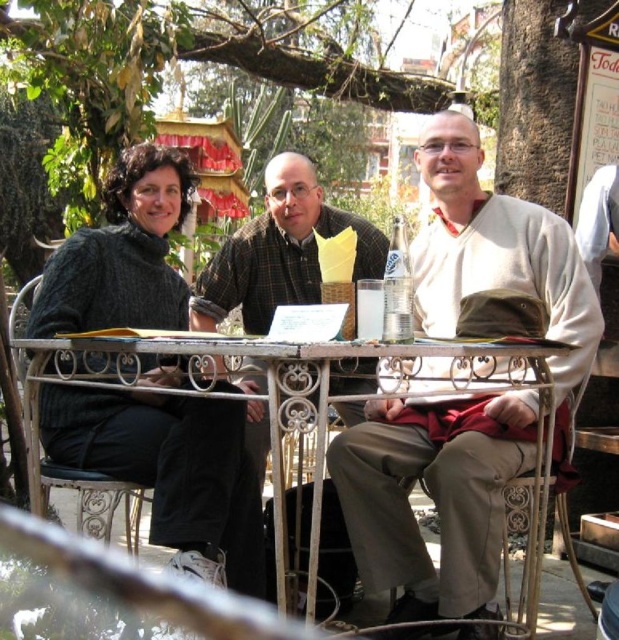
Does matte beige sweater at center have a lesser height compared to white wrought iron table at center?

Incorrect, matte beige sweater at center's height does not fall short of white wrought iron table at center's.

Who is taller, matte beige sweater at center or white wrought iron table at center?

matte beige sweater at center is taller.

This screenshot has height=640, width=619. In order to click on matte beige sweater at center in this screenshot , I will do `click(435, 484)`.

Who is taller, matte beige sweater at center or dark gray knitted sweater at left?

matte beige sweater at center is taller.

Does matte beige sweater at center have a larger size compared to dark gray knitted sweater at left?

Yes, matte beige sweater at center is bigger than dark gray knitted sweater at left.

Does point (517, 284) lie in front of point (171, 436)?

No, it is not.

Locate an element on the screen. The width and height of the screenshot is (619, 640). matte beige sweater at center is located at coordinates (435, 484).

Who is more forward, (67, 269) or (534, 445)?

Positioned in front is point (534, 445).

Is dark gray knitted sweater at left in front of white wrought iron table at center?

No, it is not.

Who is more forward, [188,570] or [79,552]?

Point [188,570] is in front.

Identify the location of dark gray knitted sweater at left. (170, 467).